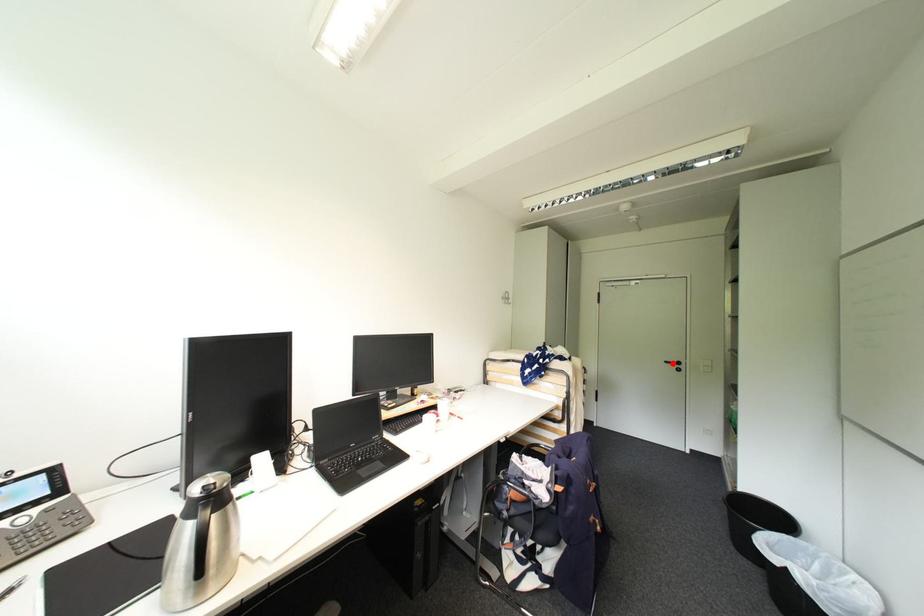
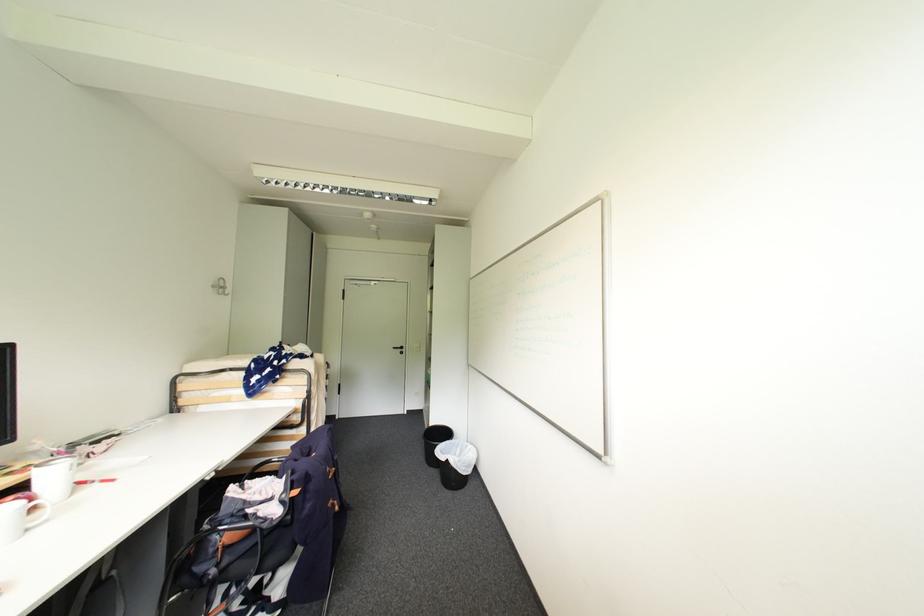
Question: I am providing you with two images of the same scene from different viewpoints. Given a red point in image1, look at the same physical point in image2. Is it:

Choices:
 (A) Closer to the viewpoint
 (B) Farther from the viewpoint

Answer: (B)